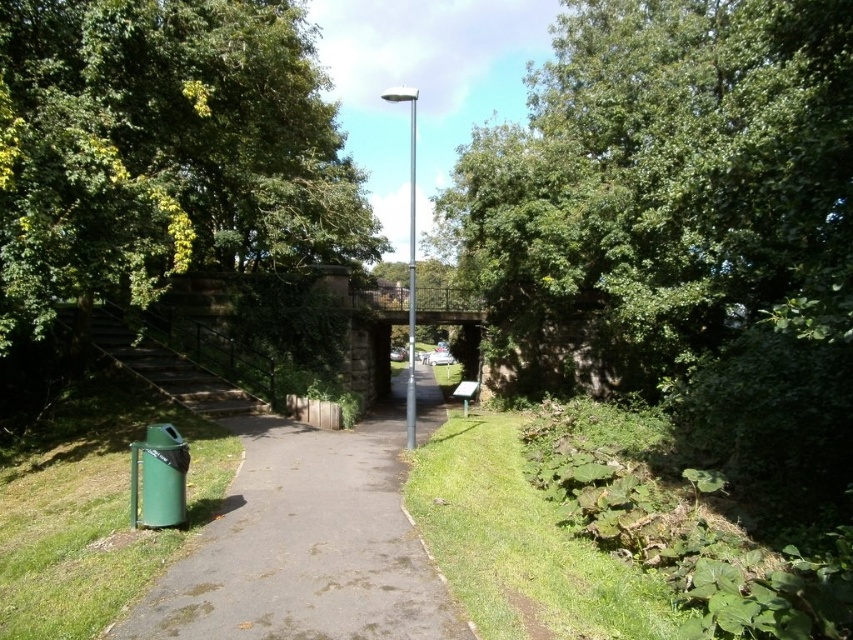
You are a hiker who wants to take a photo of the green leafy tree at upper center and the green leafy tree at upper left. Which tree should you move closer to in order to get both trees in the frame without zooming?

You should move closer to the green leafy tree at upper left because it is farther away from the viewer compared to the green leafy tree at upper center. By moving closer to it, both trees will be within the camera frame without needing to zoom.

You are standing at the start of the pathway in the park and see the green leafy tree at upper center. If you were to walk straight ahead along the pathway, would the tree remain in your line of sight? Please explain your reasoning based on its position.

The green leafy tree at upper center is located at coordinates 0.297 on the x and 0.778 on the y in the image. Since the pathway stretches into the distance and the tree is centrally positioned along the upper part of the image, it is likely that walking straight ahead would keep the tree within your line of sight as you move forward.